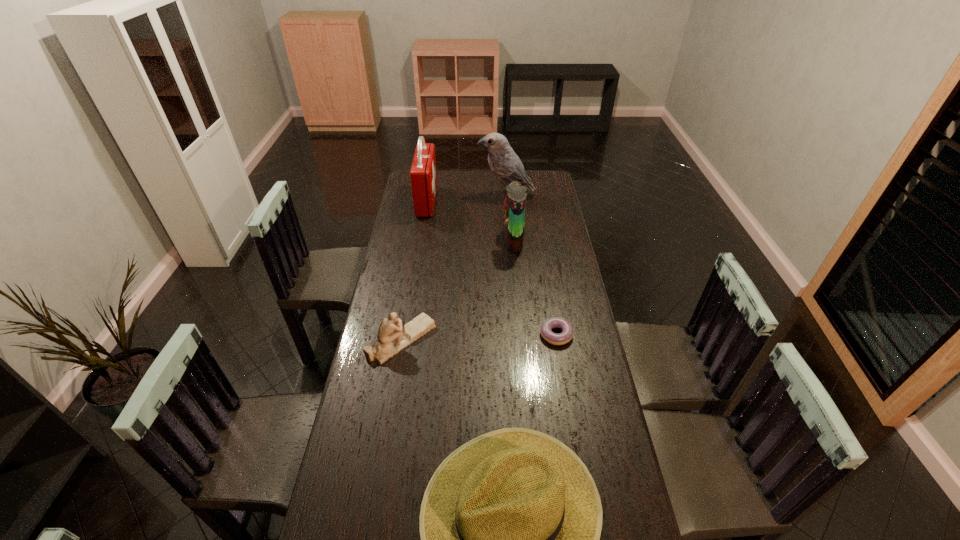
In order to click on the taller parrot in this screenshot , I will do `click(505, 164)`.

At what (x,y) coordinates should I click in order to perform the action: click on the first-aid kit. Please return your answer as a coordinate pair (x, y). Looking at the image, I should click on (423, 176).

Where is `the shorter parrot`? This screenshot has width=960, height=540. the shorter parrot is located at coordinates (514, 204).

Locate an element on the screen. the nearer parrot is located at coordinates (514, 204).

What are the coordinates of `the fifth tallest object` in the screenshot? It's located at (392, 338).

In order to click on doughnut in this screenshot , I will do `click(546, 328)`.

This screenshot has width=960, height=540. I want to click on vacant area located on the front-facing side of the taller parrot, so click(413, 196).

Identify the location of free location located on the front-facing side of the taller parrot. The height and width of the screenshot is (540, 960). (x=435, y=196).

Image resolution: width=960 pixels, height=540 pixels. What are the coordinates of `vacant space located on the front-facing side of the taller parrot` in the screenshot? It's located at (444, 196).

Where is `free space located 0.050m on the front face of the first-aid kit`? free space located 0.050m on the front face of the first-aid kit is located at coordinates (445, 201).